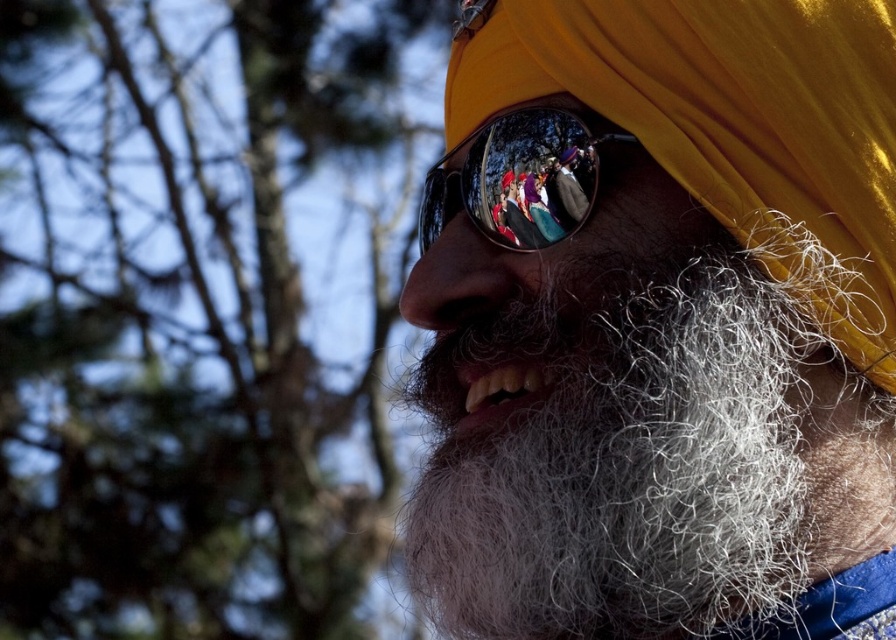
Question: Observing the image, what is the correct spatial positioning of green leafy tree at upper left in reference to shiny reflective sunglasses at center?

Choices:
 (A) right
 (B) left

Answer: (B)

Question: Which point appears closest to the camera in this image?

Choices:
 (A) (450, 193)
 (B) (820, 195)

Answer: (B)

Question: Considering the real-world distances, which object is closest to the yellow matte turban at center?

Choices:
 (A) shiny reflective sunglasses at center
 (B) green leafy tree at upper left

Answer: (A)

Question: Is yellow matte turban at center closer to the viewer compared to green leafy tree at upper left?

Choices:
 (A) yes
 (B) no

Answer: (A)

Question: Which object appears closest to the camera in this image?

Choices:
 (A) green leafy tree at upper left
 (B) shiny reflective sunglasses at center

Answer: (B)

Question: Is yellow matte turban at center below green leafy tree at upper left?

Choices:
 (A) no
 (B) yes

Answer: (B)